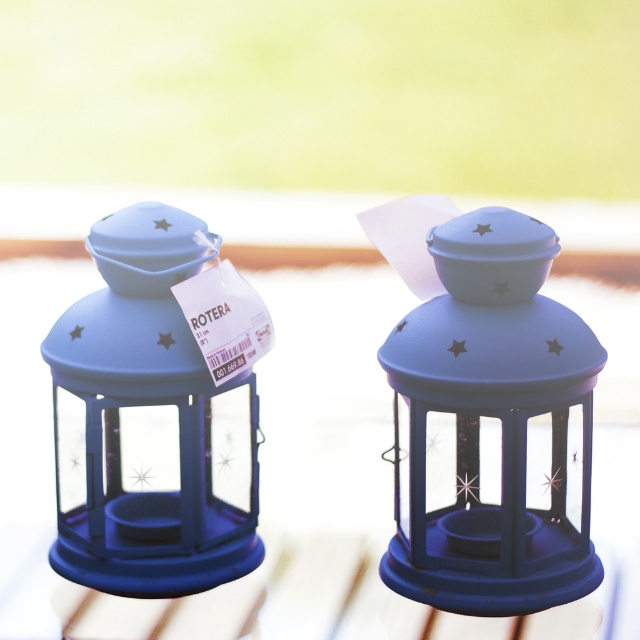
You are setting up a table for a garden party and have two matte blue lanterns. You want to place them exactly 6 inches apart. Currently, the matte blue lantern at center and the matte blue lantern at left are positioned as shown. Do you need to move them closer together or farther apart to achieve the desired spacing?

The matte blue lantern at center is currently 5.26 inches away from the matte blue lantern at left. Since 5.26 inches is less than the desired 6 inches, you need to move them farther apart to reach the required distance.

You are standing in front of the two lanterns and want to place a small decoration between them. Which point, point (502,349) or point (154,246), is closer to you where you can easily reach to place the decoration?

Point (502,349) is closer to the viewer than point (154,246), so you can easily reach it to place the decoration there.